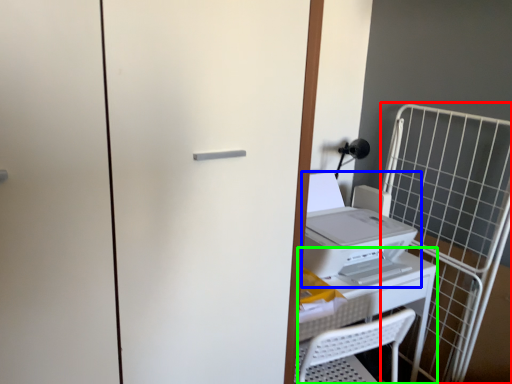
Question: Estimate the real-world distances between objects in this image. Which object is farther from cage (highlighted by a red box), home appliance (highlighted by a blue box) or table (highlighted by a green box)?

Choices:
 (A) home appliance
 (B) table

Answer: (A)